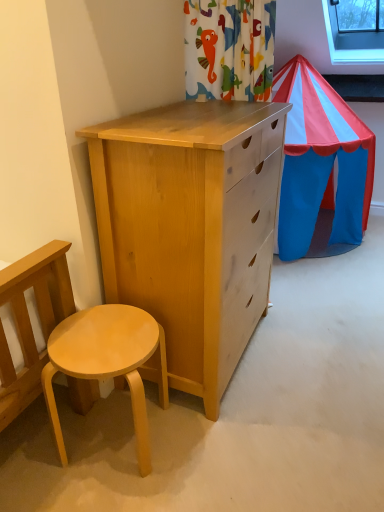
Identify the location of free space above light wood stool at lower left (from a real-world perspective). (108, 337).